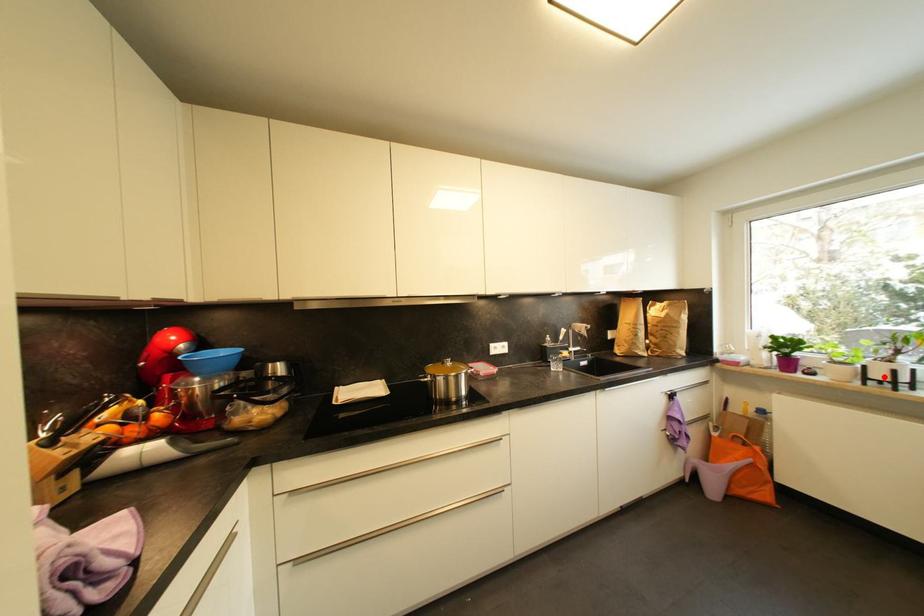
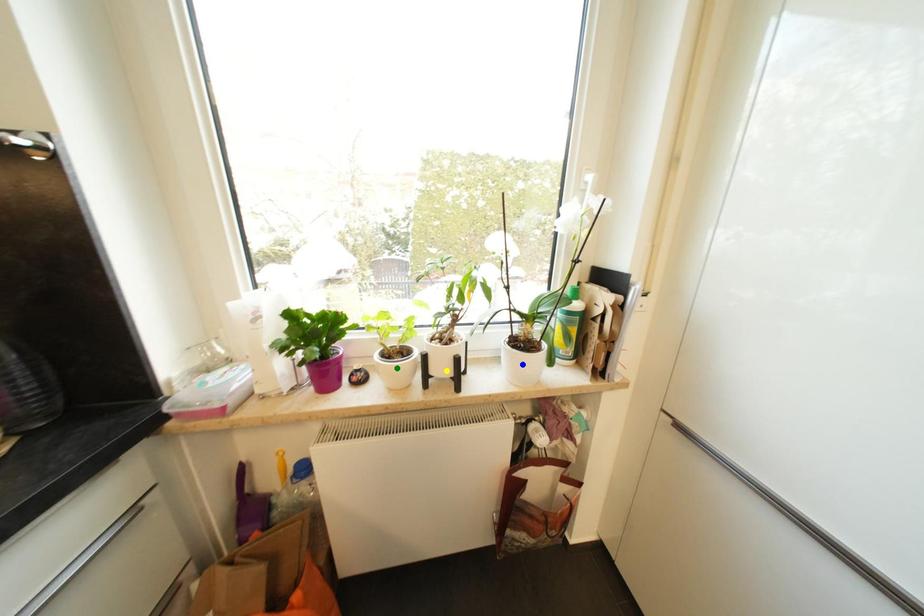
Question: I am providing you with two images of the same scene from different viewpoints. A red point is marked on the first image. You are given multiple points on the second image. Which point in image 2 is actually the same real-world point as the red point in image 1?

Choices:
 (A) blue point
 (B) yellow point
 (C) green point

Answer: (B)